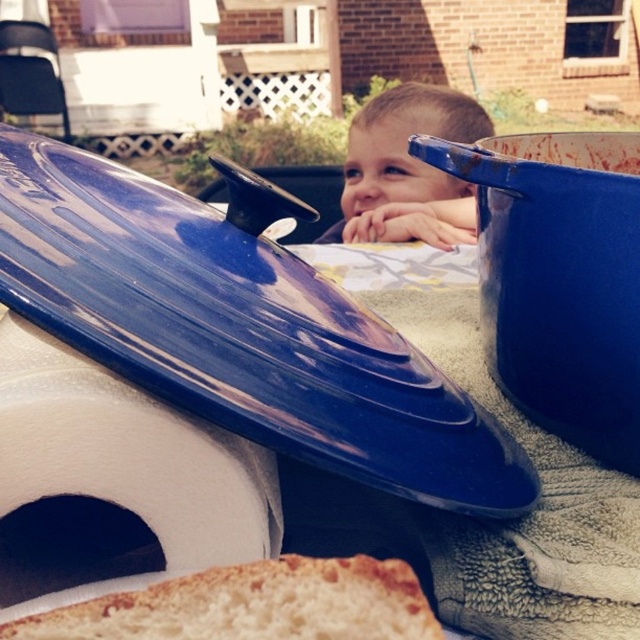
Which of these two, glossy blue lid at center or smooth skin toddler at center, stands taller?

smooth skin toddler at center is taller.

Is glossy blue lid at center thinner than smooth skin toddler at center?

Correct, glossy blue lid at center's width is less than smooth skin toddler at center's.

Between point (467, 502) and point (458, 109), which one is positioned in front?

Point (467, 502) is in front.

Identify the location of glossy blue lid at center. This screenshot has width=640, height=640. (240, 326).

Is white foam toilet paper at lower left thinner than smooth skin toddler at center?

Yes, white foam toilet paper at lower left is thinner than smooth skin toddler at center.

Which of these two, white foam toilet paper at lower left or smooth skin toddler at center, stands shorter?

With less height is white foam toilet paper at lower left.

Find the location of `white foam toilet paper at lower left`. white foam toilet paper at lower left is located at coordinates (122, 468).

Who is lower down, golden brown crusty bread at lower center or smooth skin toddler at center?

Positioned lower is golden brown crusty bread at lower center.

Locate an element on the screen. Image resolution: width=640 pixels, height=640 pixels. golden brown crusty bread at lower center is located at coordinates (252, 605).